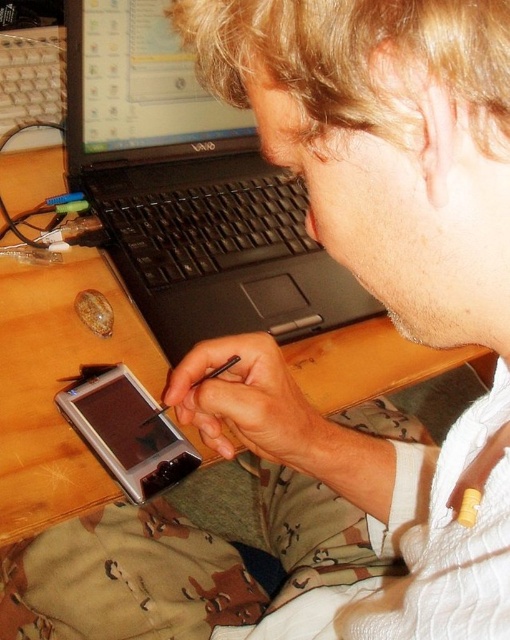
What are the coordinates of the black plastic laptop at upper center?

The black plastic laptop at upper center is located at point (189,189).

You are a person sitting at the desk. You want to reach for the point at coordinates point (183, 168) and point (8, 380). Which point is closer to you?

Point (8, 380) is closer to you because it is in front of point (183, 168).